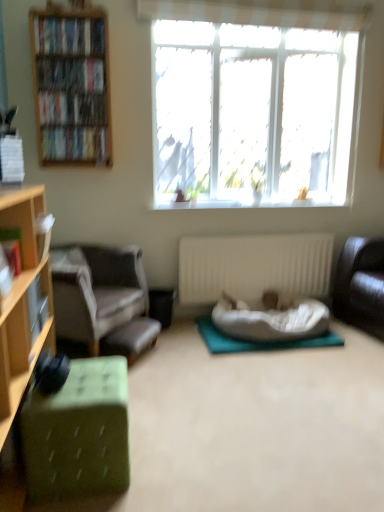
Question: Does hardcover books at left, marked as the 5th book in a bottom-to-top arrangement, have a greater width compared to hardcover book at left, which appears as the 6th book when viewed from the top?

Choices:
 (A) no
 (B) yes

Answer: (B)

Question: Is hardcover books at left, positioned as the second book in top-to-bottom order, closer to the viewer compared to hardcover book at left, marked as the 5th book in a back-to-front arrangement?

Choices:
 (A) yes
 (B) no

Answer: (B)

Question: Is hardcover books at left, marked as the 5th book in a bottom-to-top arrangement, completely or partially outside of hardcover book at left, which ranks as the first book in bottom-to-top order?

Choices:
 (A) no
 (B) yes

Answer: (B)

Question: Considering the relative sizes of hardcover books at left, which is the third book from back to front, and hardcover book at left, which ranks as the first book in bottom-to-top order, in the image provided, is hardcover books at left, which is the third book from back to front, taller than hardcover book at left, which ranks as the first book in bottom-to-top order,?

Choices:
 (A) no
 (B) yes

Answer: (A)

Question: Does hardcover books at left, which is the third book from back to front, appear on the left side of hardcover book at left, which ranks as the first book in bottom-to-top order?

Choices:
 (A) no
 (B) yes

Answer: (B)

Question: Is there a large distance between hardcover books at left, which is the fourth book in front-to-back order, and hardcover book at left, marked as the 5th book in a back-to-front arrangement?

Choices:
 (A) no
 (B) yes

Answer: (B)

Question: Considering the relative sizes of hardcover book at upper left, the 1th book when ordered from back to front, and white ribbed radiator at center in the image provided, is hardcover book at upper left, the 1th book when ordered from back to front, smaller than white ribbed radiator at center?

Choices:
 (A) yes
 (B) no

Answer: (A)

Question: Is hardcover book at upper left, the 1th book when ordered from back to front, thinner than white ribbed radiator at center?

Choices:
 (A) yes
 (B) no

Answer: (B)

Question: Can you confirm if hardcover book at upper left, the 1th book when ordered from back to front, is positioned to the left of white ribbed radiator at center?

Choices:
 (A) no
 (B) yes

Answer: (B)

Question: From a real-world perspective, is hardcover book at upper left, the 1th book when ordered from back to front, on top of white ribbed radiator at center?

Choices:
 (A) no
 (B) yes

Answer: (B)

Question: Is hardcover book at upper left, acting as the fourth book starting from the top, positioned behind white ribbed radiator at center?

Choices:
 (A) no
 (B) yes

Answer: (A)

Question: Could you tell me if hardcover book at upper left, acting as the 6th book starting from the front, is turned towards white ribbed radiator at center?

Choices:
 (A) yes
 (B) no

Answer: (B)

Question: From a real-world perspective, is gray fabric chair at left over white ribbed radiator at center?

Choices:
 (A) no
 (B) yes

Answer: (A)